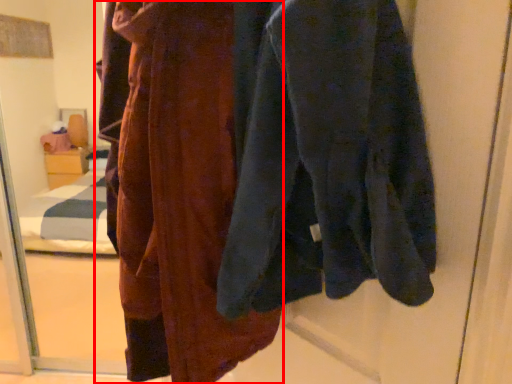
Question: Considering the relative positions of fancy dress (annotated by the red box) and sweatshirt in the image provided, where is fancy dress (annotated by the red box) located with respect to the staircase?

Choices:
 (A) right
 (B) left

Answer: (B)